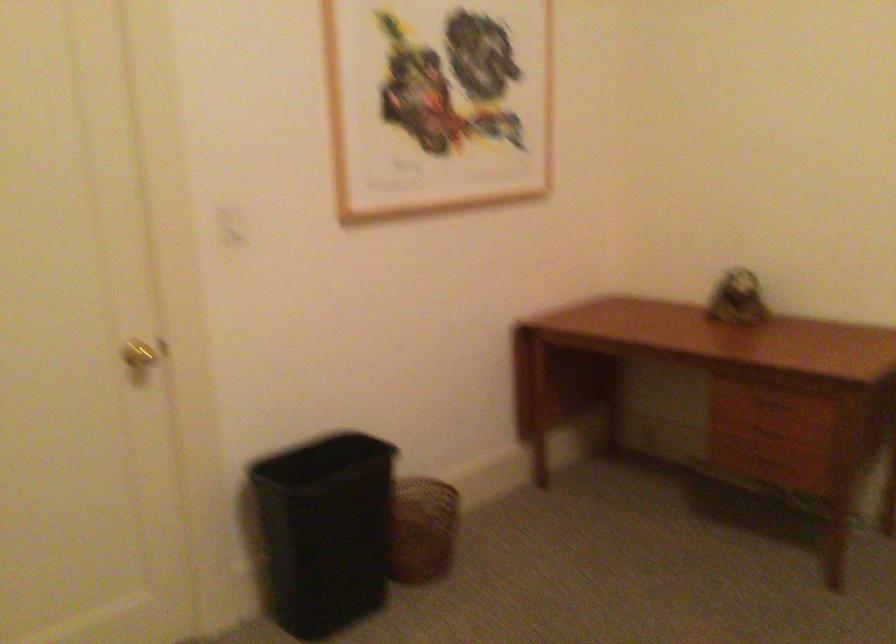
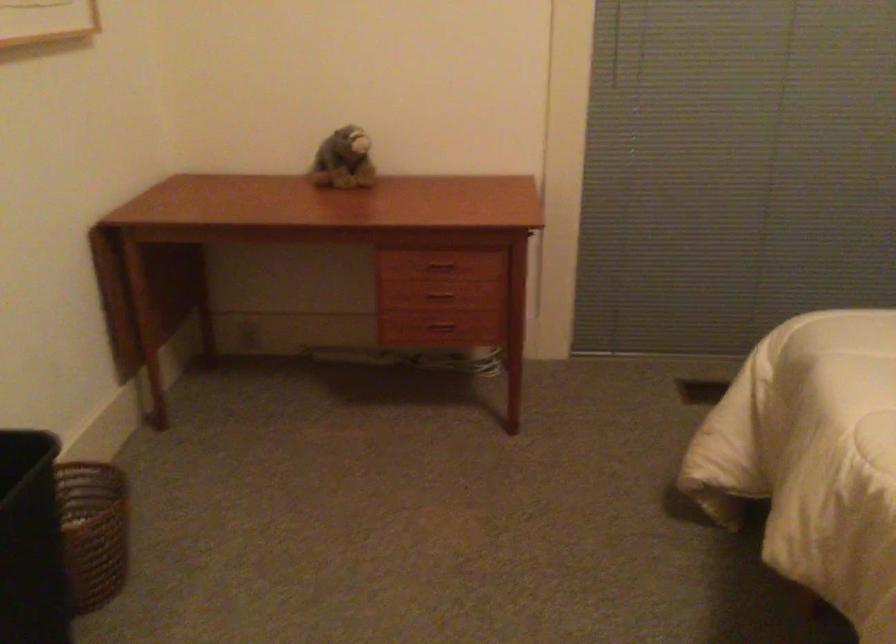
Question: Based on the continuous images, in which direction is the camera rotating? Reply with the corresponding letter.

Choices:
 (A) Left
 (B) Right
 (C) Up
 (D) Down

Answer: (B)